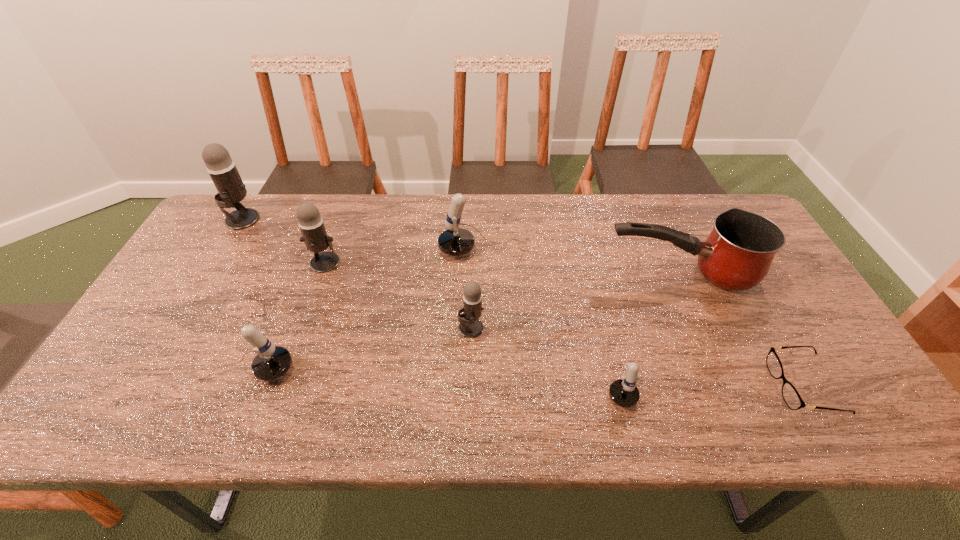
This screenshot has height=540, width=960. What are the coordinates of `the tallest microphone` in the screenshot? It's located at (222, 169).

This screenshot has height=540, width=960. In order to click on the tallest object in this screenshot , I will do `click(222, 169)`.

The image size is (960, 540). In order to click on the second gray microphone from left to right in this screenshot , I will do `click(311, 224)`.

Find the location of a particular element. The width and height of the screenshot is (960, 540). the second smallest gray microphone is located at coordinates [x=311, y=224].

The width and height of the screenshot is (960, 540). I want to click on the farthest white microphone, so click(455, 241).

Identify the location of the second white microphone from right to left. Image resolution: width=960 pixels, height=540 pixels. 455,241.

You are a GUI agent. You are given a task and a screenshot of the screen. Output one action in this format:
    pyautogui.click(x=<x>, y=<y>)
    Task: Click on the saucepan
    The width and height of the screenshot is (960, 540).
    Given the screenshot: What is the action you would take?
    pyautogui.click(x=737, y=254)

You are a GUI agent. You are given a task and a screenshot of the screen. Output one action in this format:
    pyautogui.click(x=<x>, y=<y>)
    Task: Click on the second biggest white microphone
    Image resolution: width=960 pixels, height=540 pixels.
    Given the screenshot: What is the action you would take?
    pyautogui.click(x=271, y=362)

At what (x,y) coordinates should I click in order to perform the action: click on the smallest gray microphone. Please return your answer as a coordinate pair (x, y). Image resolution: width=960 pixels, height=540 pixels. Looking at the image, I should click on (470, 327).

Where is `the nearest gray microphone`? This screenshot has width=960, height=540. the nearest gray microphone is located at coordinates (470, 327).